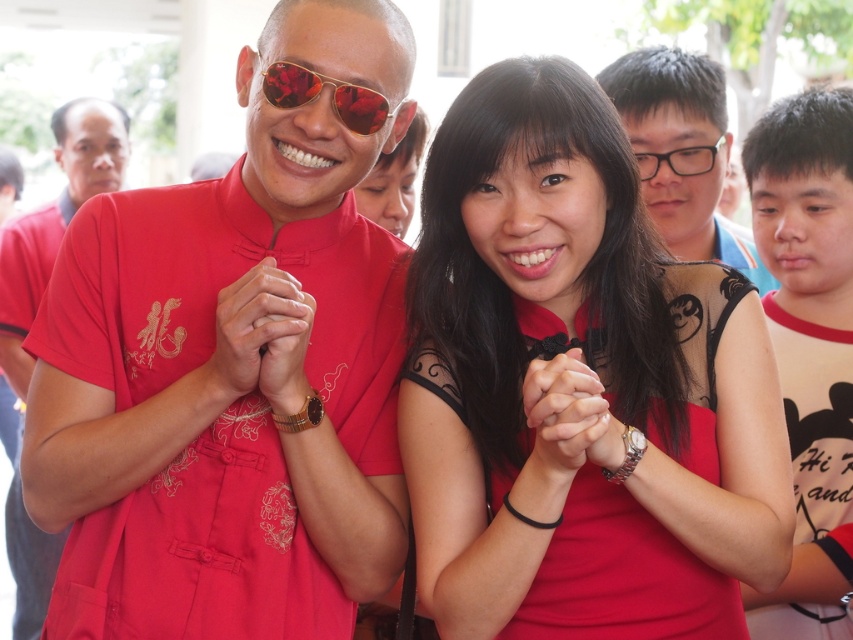
Measure the distance between white cotton t-shirt at right and transparent plastic glasses at upper right.

23.83 inches

Between white cotton t-shirt at right and transparent plastic glasses at upper right, which one is positioned lower?

white cotton t-shirt at right is lower down.

Is point (842, 609) behind point (695, 168)?

No, it is not.

The height and width of the screenshot is (640, 853). I want to click on white cotton t-shirt at right, so click(x=809, y=346).

Who is more distant from viewer, (701, 104) or (10, 285)?

Point (10, 285)

The width and height of the screenshot is (853, 640). What are the coordinates of `matte black glasses at upper center` in the screenshot? It's located at (682, 150).

Is matte red shirt at left wider than transparent plastic glasses at upper right?

Yes.

Can you confirm if matte red shirt at left is bigger than transparent plastic glasses at upper right?

Yes.

Does point (67, 180) come farther from viewer compared to point (648, 157)?

Yes, it is.

Locate an element on the screen. matte red shirt at left is located at coordinates (55, 220).